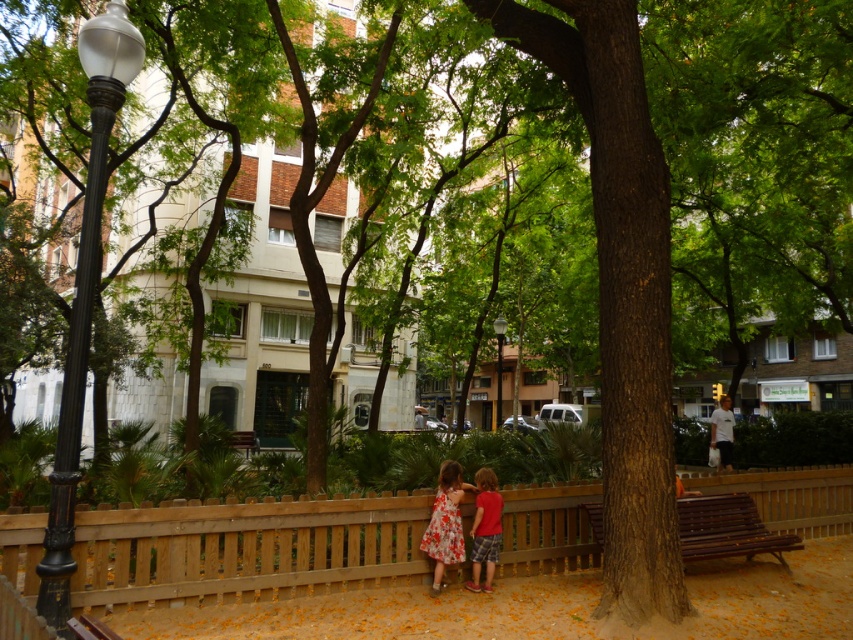
Question: Does floral dress at center appear on the left side of white glass lamp post at center?

Choices:
 (A) no
 (B) yes

Answer: (B)

Question: Which object is positioned farthest from the white glass lamp post at center?

Choices:
 (A) wooden at lower center
 (B) brown wooden bench at center
 (C) red cotton shirt at center
 (D) black polished metal lamp post at left

Answer: (A)

Question: Does brown wooden bench at center appear on the right side of floral dress at center?

Choices:
 (A) yes
 (B) no

Answer: (A)

Question: Which of the following is the closest to the observer?

Choices:
 (A) (129, 52)
 (B) (496, 380)

Answer: (A)

Question: Which of the following is the closest to the observer?

Choices:
 (A) (90, 177)
 (B) (741, 524)
 (C) (479, 518)
 (D) (496, 337)

Answer: (A)

Question: Does wooden at lower center appear under black polished metal lamp post at left?

Choices:
 (A) yes
 (B) no

Answer: (A)